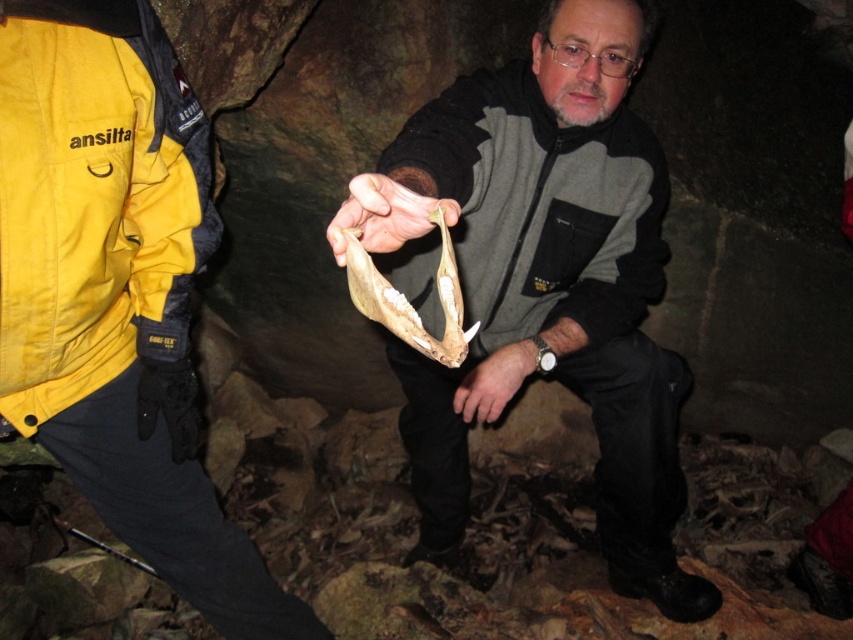
You are a photographer trying to capture a clear photo of the smooth bone at center. You notice the matte black jacket at center is blocking part of the bone. Based on their sizes, which object is wider and might be causing the obstruction?

The matte black jacket at center is wider than the smooth bone at center, so it is likely causing the obstruction.

You are an archaeologist standing in the cave. You need to place a marker at the exact center of the image to mark the location of the matte black jacket at center. What coordinates should you input into your mapping device?

The coordinates for the matte black jacket at center are at point (117, 292).

You are a photographer standing in the cave and want to take a picture of the matte black jacket at center and the matte bone at center. Which object should you focus on first if you want to capture both in focus without adjusting the camera settings?

The matte black jacket at center is taller than the matte bone at center, so focusing on the matte black jacket at center first would ensure both are in focus since it is closer to the camera.